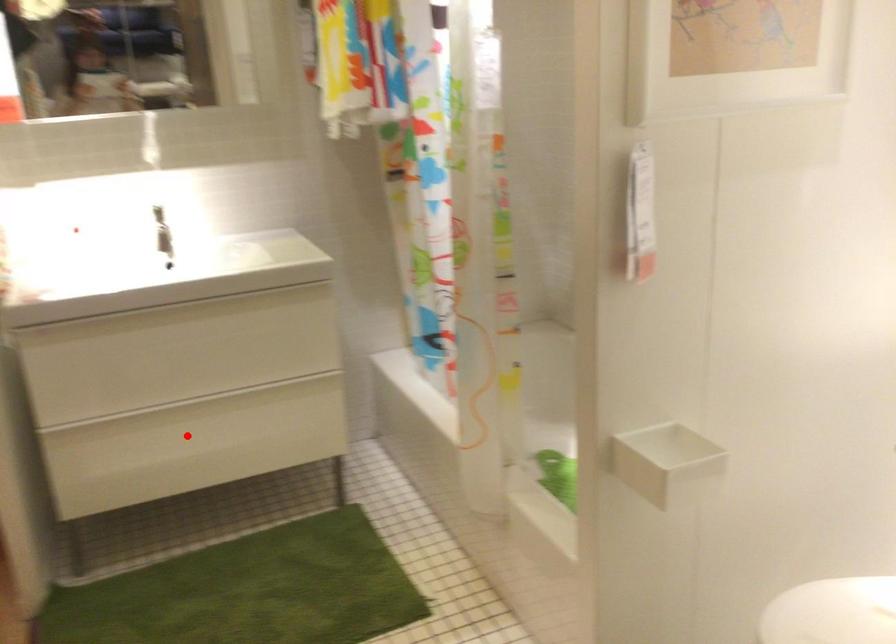
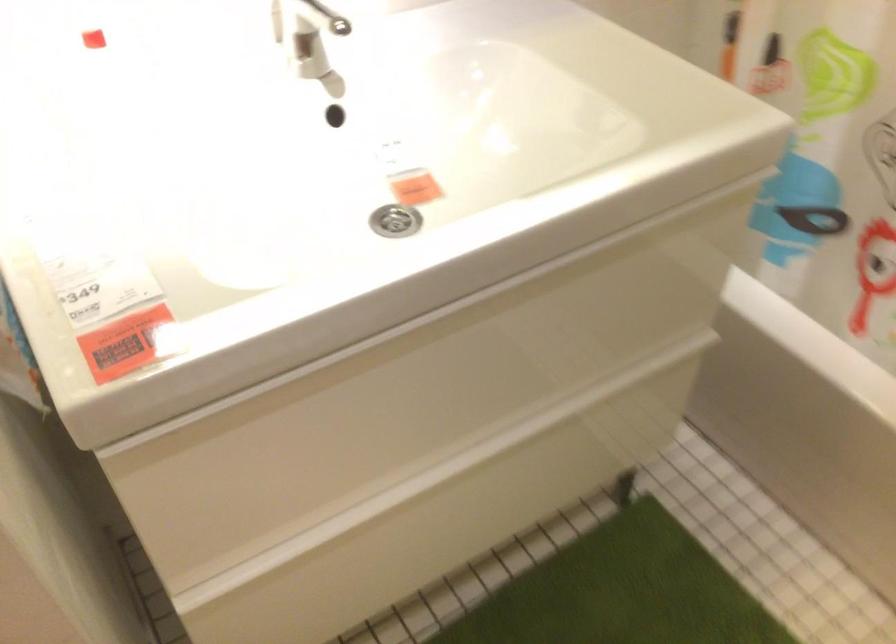
Question: I am providing you with two images of the same scene from different viewpoints. In image1, a red point is highlighted. Considering the same 3D point in image2, which of the following is correct?

Choices:
 (A) It is closer
 (B) It is farther

Answer: (A)